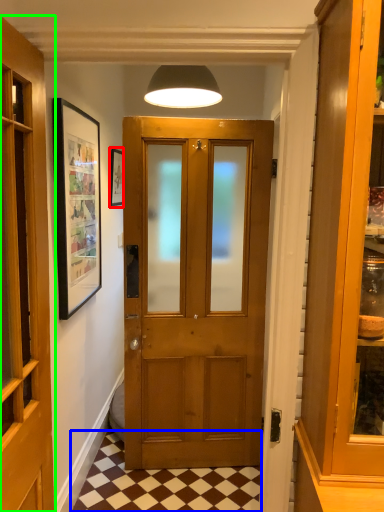
Question: Which object is the closest to the picture frame (highlighted by a red box)? Choose among these: tile (highlighted by a blue box) or door (highlighted by a green box).

Choices:
 (A) tile
 (B) door

Answer: (B)